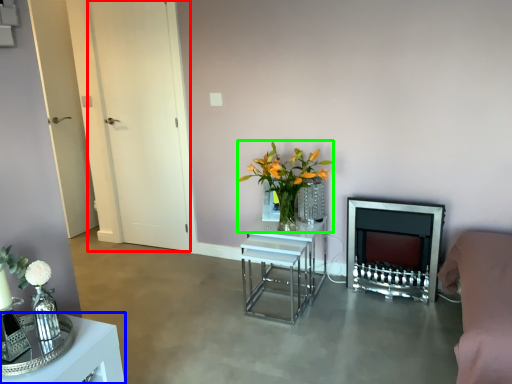
Question: Estimate the real-world distances between objects in this image. Which object is farther from glass door (highlighted by a red box), table (highlighted by a blue box) or floral arrangement (highlighted by a green box)?

Choices:
 (A) table
 (B) floral arrangement

Answer: (A)